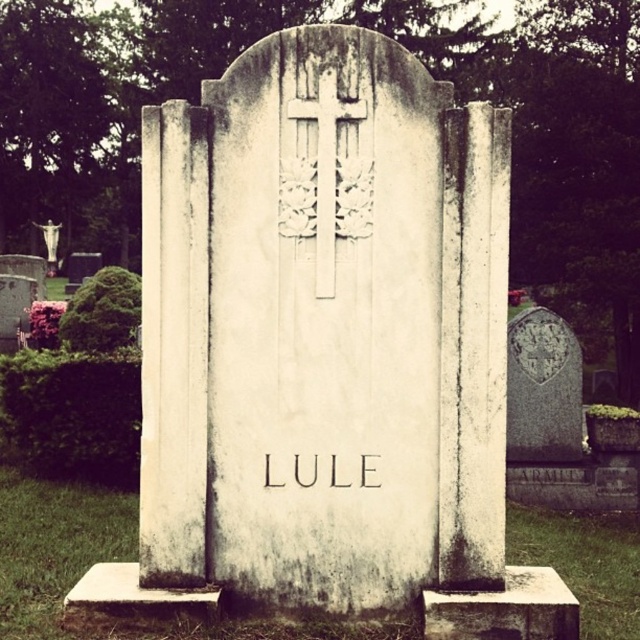
The width and height of the screenshot is (640, 640). Identify the location of white marble gravestone at center. (504, 609).

Is white marble gravestone at center positioned at the back of white carved wood cross at center?

No, white marble gravestone at center is in front of white carved wood cross at center.

What do you see at coordinates (504, 609) in the screenshot? The height and width of the screenshot is (640, 640). I see `white marble gravestone at center` at bounding box center [504, 609].

What are the coordinates of `white marble gravestone at center` in the screenshot? It's located at (504, 609).

Between white carved wood cross at center and white stone cross at upper center, which one has less height?

With less height is white stone cross at upper center.

Can you confirm if white carved wood cross at center is smaller than white stone cross at upper center?

Indeed, white carved wood cross at center has a smaller size compared to white stone cross at upper center.

Is point (330, 192) in front of point (42, 227)?

Yes, it is in front of point (42, 227).

You are a GUI agent. You are given a task and a screenshot of the screen. Output one action in this format:
    pyautogui.click(x=<x>, y=<y>)
    Task: Click on the white carved wood cross at center
    
    Given the screenshot: What is the action you would take?
    pyautogui.click(x=324, y=170)

Who is lower down, white marble gravestone at center or white stone cross at upper center?

Positioned lower is white marble gravestone at center.

Which of these two, white marble gravestone at center or white stone cross at upper center, stands shorter?

white marble gravestone at center

Is point (552, 609) behind point (52, 246)?

No, (552, 609) is in front of (52, 246).

Locate an element on the screen. white marble gravestone at center is located at coordinates (504, 609).